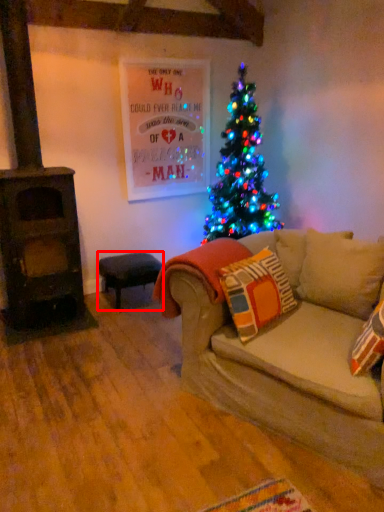
Question: Considering the relative positions of stool (annotated by the red box) and blanket in the image provided, where is stool (annotated by the red box) located with respect to the staircase?

Choices:
 (A) right
 (B) left

Answer: (B)